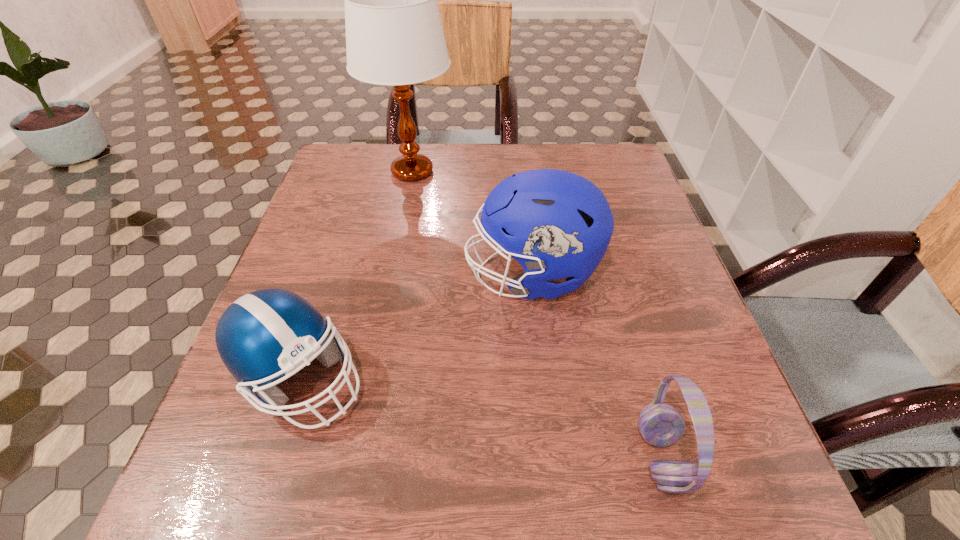
At what (x,y) coordinates should I click in order to perform the action: click on the tallest object. Please return your answer as a coordinate pair (x, y). Image resolution: width=960 pixels, height=540 pixels. Looking at the image, I should click on (394, 36).

Locate an element on the screen. the farthest object is located at coordinates (394, 36).

Where is `the right football helmet`? This screenshot has width=960, height=540. the right football helmet is located at coordinates (557, 224).

Locate an element on the screen. the taller football helmet is located at coordinates (557, 224).

Locate an element on the screen. the nearer football helmet is located at coordinates (263, 335).

Identify the location of the shorter football helmet. The image size is (960, 540). (263, 335).

Identify the location of headset. (661, 425).

Where is `free space located on the front of the farthest object`? Image resolution: width=960 pixels, height=540 pixels. free space located on the front of the farthest object is located at coordinates [x=396, y=254].

Where is `vacant space located 0.050m on the front-facing side of the right football helmet`? vacant space located 0.050m on the front-facing side of the right football helmet is located at coordinates (441, 274).

Find the location of a particular element. This screenshot has width=960, height=540. blank area located on the front-facing side of the right football helmet is located at coordinates (426, 274).